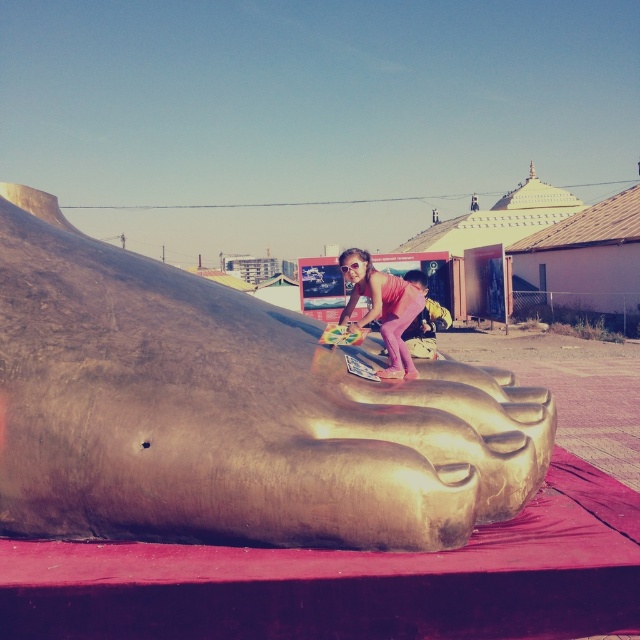
Question: Among these points, which one is nearest to the camera?

Choices:
 (A) (376, 304)
 (B) (406, 518)

Answer: (B)

Question: Which point appears farthest from the camera in this image?

Choices:
 (A) (346, 500)
 (B) (358, 280)

Answer: (B)

Question: Can you confirm if gold metallic foot at center is thinner than pink matte pants at center?

Choices:
 (A) yes
 (B) no

Answer: (B)

Question: Does gold metallic foot at center have a greater width compared to pink matte pants at center?

Choices:
 (A) yes
 (B) no

Answer: (A)

Question: Can you confirm if gold metallic foot at center is positioned below pink matte pants at center?

Choices:
 (A) no
 (B) yes

Answer: (B)

Question: Among these objects, which one is nearest to the camera?

Choices:
 (A) gold metallic foot at center
 (B) pink matte pants at center

Answer: (A)